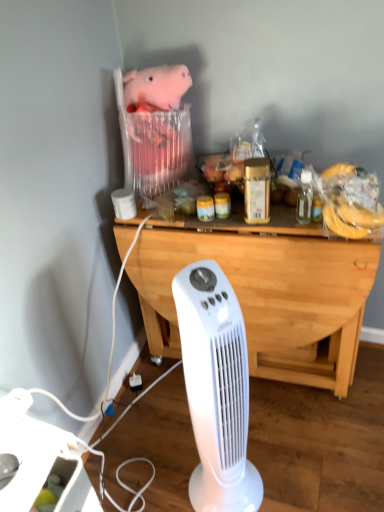
Question: Is the position of light wood/dark brown desk at center less distant than that of white plastic power strip at lower left?

Choices:
 (A) no
 (B) yes

Answer: (A)

Question: Considering the relative sizes of light wood/dark brown desk at center and white plastic power strip at lower left in the image provided, is light wood/dark brown desk at center wider than white plastic power strip at lower left?

Choices:
 (A) yes
 (B) no

Answer: (A)

Question: Is light wood/dark brown desk at center not inside white plastic power strip at lower left?

Choices:
 (A) no
 (B) yes

Answer: (B)

Question: Considering the relative sizes of light wood/dark brown desk at center and white plastic power strip at lower left in the image provided, is light wood/dark brown desk at center bigger than white plastic power strip at lower left?

Choices:
 (A) yes
 (B) no

Answer: (A)

Question: Can you confirm if light wood/dark brown desk at center is thinner than white plastic power strip at lower left?

Choices:
 (A) yes
 (B) no

Answer: (B)

Question: Is point (240, 451) positioned closer to the camera than point (29, 487)?

Choices:
 (A) closer
 (B) farther

Answer: (B)

Question: From a real-world perspective, is white plastic fan at center physically located above or below white plastic power strip at lower left?

Choices:
 (A) above
 (B) below

Answer: (A)

Question: Considering the positions of white plastic fan at center and white plastic power strip at lower left in the image, is white plastic fan at center taller or shorter than white plastic power strip at lower left?

Choices:
 (A) tall
 (B) short

Answer: (A)

Question: Based on their positions, is white plastic fan at center located to the left or right of white plastic power strip at lower left?

Choices:
 (A) left
 (B) right

Answer: (B)

Question: From a real-world perspective, is white plastic fan at center physically located above or below light wood/dark brown desk at center?

Choices:
 (A) above
 (B) below

Answer: (A)

Question: Is point [x=238, y=450] positioned closer to the camera than point [x=344, y=282]?

Choices:
 (A) closer
 (B) farther

Answer: (A)

Question: Considering the positions of white plastic fan at center and light wood/dark brown desk at center in the image, is white plastic fan at center bigger or smaller than light wood/dark brown desk at center?

Choices:
 (A) big
 (B) small

Answer: (B)

Question: Is white plastic fan at center taller or shorter than light wood/dark brown desk at center?

Choices:
 (A) tall
 (B) short

Answer: (A)

Question: Based on their positions, is clear glass bottle at upper right located to the left or right of white plastic fan at center?

Choices:
 (A) left
 (B) right

Answer: (B)

Question: Considering the positions of point (309, 211) and point (241, 440), is point (309, 211) closer or farther from the camera than point (241, 440)?

Choices:
 (A) closer
 (B) farther

Answer: (B)